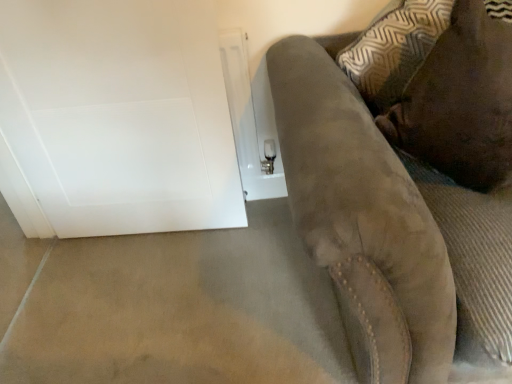
Question: Is there a large distance between beige carpet at lower left and brown suede pillow at upper right?

Choices:
 (A) yes
 (B) no

Answer: (B)

Question: Is beige carpet at lower left thinner than brown suede pillow at upper right?

Choices:
 (A) yes
 (B) no

Answer: (B)

Question: Is beige carpet at lower left smaller than brown suede pillow at upper right?

Choices:
 (A) no
 (B) yes

Answer: (B)

Question: Does beige carpet at lower left have a lesser height compared to brown suede pillow at upper right?

Choices:
 (A) no
 (B) yes

Answer: (B)

Question: From a real-world perspective, is beige carpet at lower left under brown suede pillow at upper right?

Choices:
 (A) yes
 (B) no

Answer: (A)

Question: Considering the relative positions of beige carpet at lower left and brown suede pillow at upper right in the image provided, is beige carpet at lower left to the left of brown suede pillow at upper right from the viewer's perspective?

Choices:
 (A) yes
 (B) no

Answer: (A)

Question: From the image's perspective, is brown suede pillow at upper right on beige carpet at lower left?

Choices:
 (A) no
 (B) yes

Answer: (B)

Question: Is brown suede pillow at upper right bigger than beige carpet at lower left?

Choices:
 (A) no
 (B) yes

Answer: (B)

Question: Considering the relative positions of brown suede pillow at upper right and beige carpet at lower left in the image provided, is brown suede pillow at upper right to the left of beige carpet at lower left from the viewer's perspective?

Choices:
 (A) no
 (B) yes

Answer: (A)

Question: Is brown suede pillow at upper right turned away from beige carpet at lower left?

Choices:
 (A) no
 (B) yes

Answer: (A)

Question: Is brown suede pillow at upper right in front of beige carpet at lower left?

Choices:
 (A) yes
 (B) no

Answer: (A)

Question: Is brown suede pillow at upper right thinner than beige carpet at lower left?

Choices:
 (A) no
 (B) yes

Answer: (B)

Question: From the image's perspective, is suede couch at right above beige carpet at lower left?

Choices:
 (A) yes
 (B) no

Answer: (A)